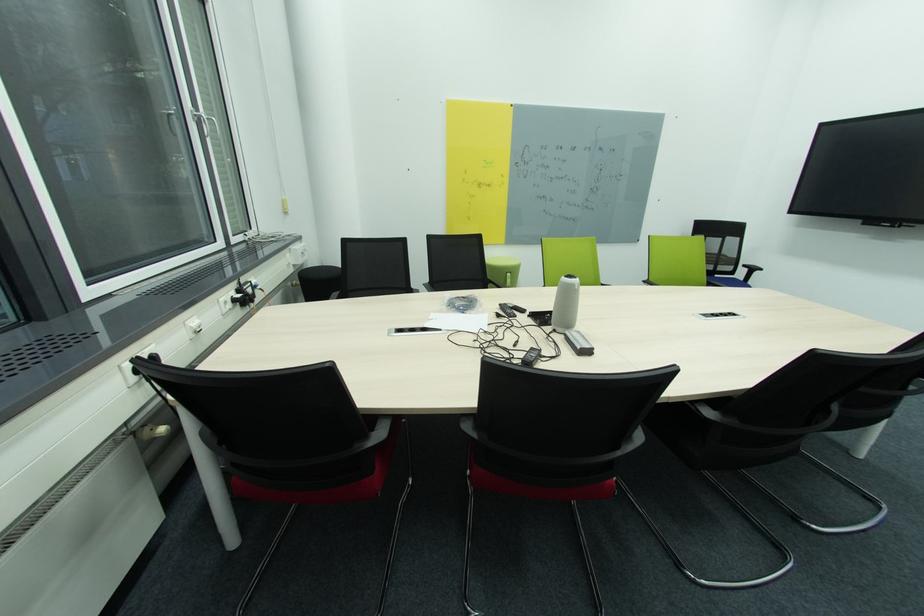
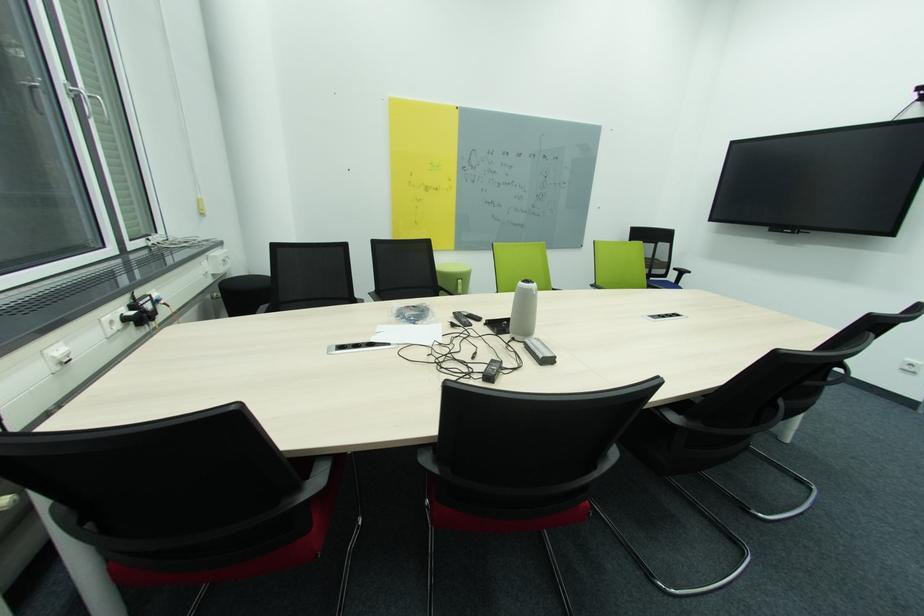
Locate, in the second image, the point that corresponds to pixel 314 268 in the first image.

(238, 278)